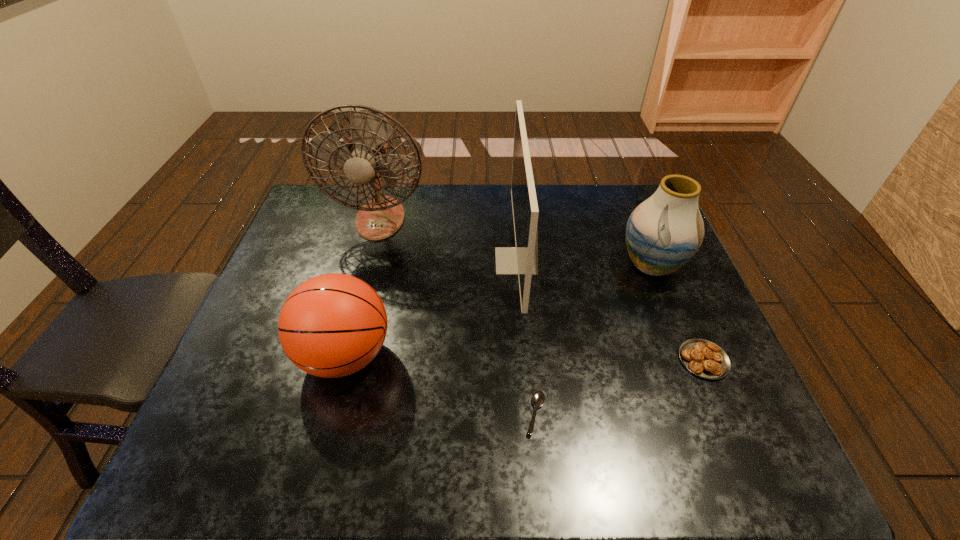
Image resolution: width=960 pixels, height=540 pixels. Find the location of `pastry that is at the right edge`. pastry that is at the right edge is located at coordinates (705, 359).

Identify the location of object at the far left corner. This screenshot has height=540, width=960. (365, 159).

In the image, there is a desktop. What are the coordinates of `free space at the far edge` in the screenshot? It's located at (442, 192).

The width and height of the screenshot is (960, 540). In the image, there is a desktop. In order to click on free space at the near edge in this screenshot , I will do `click(300, 478)`.

The height and width of the screenshot is (540, 960). I want to click on vacant space at the left edge of the desktop, so click(265, 389).

Identify the location of free spot at the right edge of the desktop. The image size is (960, 540). (686, 285).

Identify the location of vacant space at the far left corner of the desktop. (349, 215).

Locate an element on the screen. The height and width of the screenshot is (540, 960). free space at the far right corner of the desktop is located at coordinates (609, 203).

This screenshot has height=540, width=960. I want to click on vacant area that lies between the fifth tallest object and the basketball, so click(x=524, y=357).

At what (x,y) coordinates should I click in order to perform the action: click on vacant region between the monitor and the fan. Please return your answer as a coordinate pair (x, y). Looking at the image, I should click on (448, 240).